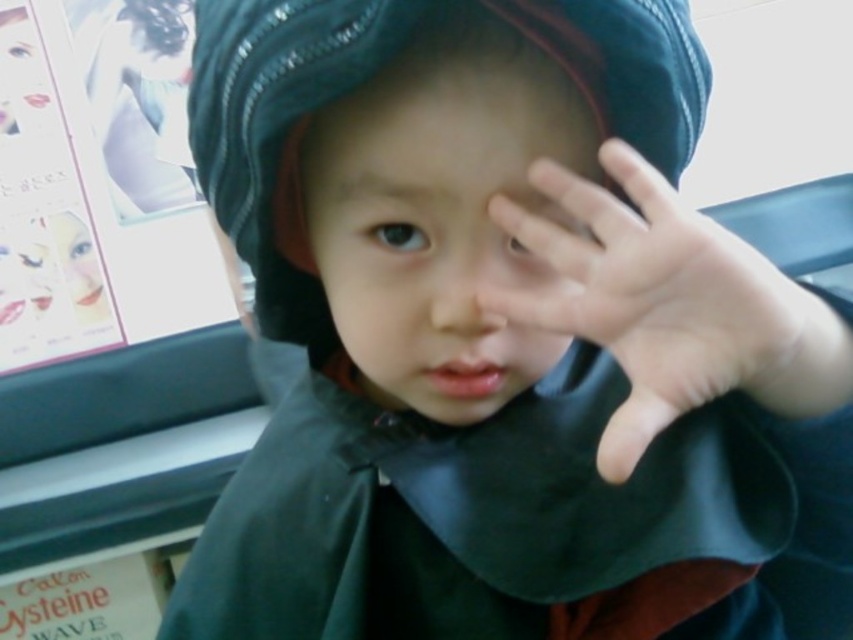
Does smooth skin face at center appear on the left side of denim hat at center?

Incorrect, smooth skin face at center is not on the left side of denim hat at center.

Consider the image. Is smooth skin face at center positioned before denim hat at center?

That is False.

Between point (340, 116) and point (659, 60), which one is positioned behind?

The point (340, 116) is more distant.

The height and width of the screenshot is (640, 853). Find the location of `smooth skin face at center`. smooth skin face at center is located at coordinates (440, 220).

Can you confirm if smooth skin face at center is positioned to the left of smooth skin hand at upper right?

Yes, smooth skin face at center is to the left of smooth skin hand at upper right.

Is point (552, 211) in front of point (523, 317)?

No.

I want to click on smooth skin face at center, so click(440, 220).

Between denim hat at center and smooth skin hand at upper right, which one appears on the right side from the viewer's perspective?

smooth skin hand at upper right is more to the right.

Between denim hat at center and smooth skin hand at upper right, which one appears on the left side from the viewer's perspective?

denim hat at center is more to the left.

Who is more distant from viewer, (x=483, y=8) or (x=543, y=234)?

Positioned behind is point (x=543, y=234).

Identify the location of denim hat at center. (280, 144).